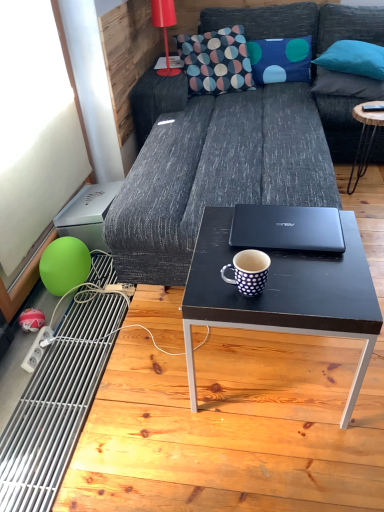
Locate an element on the screen. The width and height of the screenshot is (384, 512). black wood coffee table at right, which is the 1th coffee table in top-to-bottom order is located at coordinates (364, 140).

Measure the distance between point (200, 65) and camera.

Point (200, 65) and camera are 2.70 meters apart.

This screenshot has height=512, width=384. What do you see at coordinates (248, 271) in the screenshot? I see `white dotted ceramic mug at center` at bounding box center [248, 271].

Image resolution: width=384 pixels, height=512 pixels. In order to click on black wood coffee table at right, which is counted as the first coffee table, starting from the back in this screenshot , I will do `click(364, 140)`.

Is white dotted ceramic mug at center positioned in front of dark gray fabric couch at center?

A: Yes, it is.

Where is `studio couch that is on the right side of white dotted ceramic mug at center`? The width and height of the screenshot is (384, 512). studio couch that is on the right side of white dotted ceramic mug at center is located at coordinates (221, 166).

Does point (223, 271) come closer to viewer compared to point (326, 168)?

Yes, it is in front of point (326, 168).

Considering the sizes of objects white dotted ceramic mug at center and matte red lamp at upper left in the image provided, who is thinner, white dotted ceramic mug at center or matte red lamp at upper left?

white dotted ceramic mug at center.

Image resolution: width=384 pixels, height=512 pixels. Identify the location of coffee cup below the matte red lamp at upper left (from a real-world perspective). (248, 271).

Is white dotted ceramic mug at center at the left side of matte red lamp at upper left?

No.

Would you consider white dotted ceramic mug at center to be distant from matte red lamp at upper left?

That's right, there is a large distance between white dotted ceramic mug at center and matte red lamp at upper left.

How many degrees apart are the facing directions of dark gray fabric couch at center and matte green balloon at lower left?

The angle between the facing direction of dark gray fabric couch at center and the facing direction of matte green balloon at lower left is 89.1 degrees.

Is matte green balloon at lower left surrounded by dark gray fabric couch at center?

No, matte green balloon at lower left is not surrounded by dark gray fabric couch at center.

Locate an element on the screen. The image size is (384, 512). studio couch on the right side of matte green balloon at lower left is located at coordinates (221, 166).

What's the angular difference between teal fabric pillow at upper right, placed as the second pillow when sorted from left to right, and white dotted ceramic mug at center's facing directions?

The angular difference between teal fabric pillow at upper right, placed as the second pillow when sorted from left to right, and white dotted ceramic mug at center is 26.4 degrees.

How distant is teal fabric pillow at upper right, placed as the second pillow when sorted from left to right, from white dotted ceramic mug at center?

teal fabric pillow at upper right, placed as the second pillow when sorted from left to right, and white dotted ceramic mug at center are 6.16 feet apart from each other.

Considering the sizes of objects teal fabric pillow at upper right, placed as the second pillow when sorted from left to right, and white dotted ceramic mug at center in the image provided, who is wider, teal fabric pillow at upper right, placed as the second pillow when sorted from left to right, or white dotted ceramic mug at center?

Wider between the two is teal fabric pillow at upper right, placed as the second pillow when sorted from left to right.

From a real-world perspective, is teal fabric pillow at upper right, placed as the second pillow when sorted from left to right, on white dotted ceramic mug at center?

Yes, from a real-world perspective, teal fabric pillow at upper right, placed as the second pillow when sorted from left to right, is over white dotted ceramic mug at center

In the scene shown: Is black matte laptop at center directly adjacent to patterned fabric pillow at upper center?

No, black matte laptop at center is not with patterned fabric pillow at upper center.

Between black matte laptop at center and patterned fabric pillow at upper center, which one has less height?

With less height is black matte laptop at center.

Considering the relative sizes of black matte laptop at center and patterned fabric pillow at upper center in the image provided, is black matte laptop at center bigger than patterned fabric pillow at upper center?

No, black matte laptop at center is not bigger than patterned fabric pillow at upper center.

Which of these two, black matte laptop at center or patterned fabric pillow at upper center, is thinner?

With smaller width is black matte laptop at center.

Which of these two, black matte laptop at center or white dotted ceramic mug at center, stands taller?

white dotted ceramic mug at center is taller.

From a real-world perspective, relative to white dotted ceramic mug at center, is black matte laptop at center vertically above or below?

In terms of real-world spatial position, black matte laptop at center is below white dotted ceramic mug at center.

Considering their positions, is teal fabric pillow at upper right, which appears as the first pillow when viewed from the right, located in front of or behind black matte coffee table at center, which appears as the 1th coffee table when viewed from the front?

In the image, teal fabric pillow at upper right, which appears as the first pillow when viewed from the right, appears behind black matte coffee table at center, which appears as the 1th coffee table when viewed from the front.

From a real-world perspective, is teal fabric pillow at upper right, which appears as the first pillow when viewed from the right, above or below black matte coffee table at center, which is counted as the 1th coffee table, starting from the left?

teal fabric pillow at upper right, which appears as the first pillow when viewed from the right, is situated higher than black matte coffee table at center, which is counted as the 1th coffee table, starting from the left, in the real world.

Is point (378, 81) positioned before point (356, 284)?

No, it is behind (356, 284).

Locate an element on the screen. coffee cup that is on the left side of dark gray fabric couch at center is located at coordinates (248, 271).

Identify the location of coffee cup below the matte red lamp at upper left (from a real-world perspective). This screenshot has width=384, height=512. (248, 271).

Based on their spatial positions, is dark gray fabric couch at center or matte red lamp at upper left closer to black wood coffee table at right, which appears as the first coffee table when viewed from the right?

dark gray fabric couch at center lies closer to black wood coffee table at right, which appears as the first coffee table when viewed from the right, than the other object.

When comparing their distances from black matte coffee table at center, the 2th coffee table viewed from the right, does patterned fabric pillow at upper center or matte green balloon at lower left seem further?

Among the two, patterned fabric pillow at upper center is located further to black matte coffee table at center, the 2th coffee table viewed from the right.

Based on their spatial positions, is black matte laptop at center or teal fabric pillow at upper right, the 2th pillow from the right, further from matte red lamp at upper left?

black matte laptop at center is further to matte red lamp at upper left.

When comparing their distances from teal fabric pillow at upper right, the third pillow from the left, does teal fabric pillow at upper right, the 2th pillow from the right, or white dotted ceramic mug at center seem closer?

teal fabric pillow at upper right, the 2th pillow from the right, is positioned closer to the anchor teal fabric pillow at upper right, the third pillow from the left.

Considering their positions, is teal fabric pillow at upper right, which appears as the first pillow when viewed from the right, positioned further to matte green balloon at lower left than white dotted ceramic mug at center?

Based on the image, teal fabric pillow at upper right, which appears as the first pillow when viewed from the right, appears to be further to matte green balloon at lower left.

Estimate the real-world distances between objects in this image. Which object is further from dark gray fabric couch at center, black matte laptop at center or teal fabric pillow at upper right, the third pillow from the left?

Based on the image, teal fabric pillow at upper right, the third pillow from the left, appears to be further to dark gray fabric couch at center.

When comparing their distances from white dotted ceramic mug at center, does black matte laptop at center or matte green balloon at lower left seem closer?

Among the two, black matte laptop at center is located nearer to white dotted ceramic mug at center.

Consider the image. Based on their spatial positions, is white dotted ceramic mug at center or teal fabric pillow at upper right, the third pillow from the left, further from dark gray fabric couch at center?

white dotted ceramic mug at center is further to dark gray fabric couch at center.

The height and width of the screenshot is (512, 384). I want to click on throw pillow between matte red lamp at upper left and black wood coffee table at right, which appears as the first coffee table when viewed from the right, in the horizontal direction, so click(216, 61).

This screenshot has width=384, height=512. Identify the location of laptop that lies between blue dotted fabric pillow at upper center, the first pillow when ordered from left to right, and matte green balloon at lower left from top to bottom. (287, 228).

The image size is (384, 512). What are the coordinates of `studio couch situated between matte green balloon at lower left and black matte laptop at center from left to right` in the screenshot? It's located at (221, 166).

The height and width of the screenshot is (512, 384). I want to click on studio couch between black matte coffee table at center, the first coffee table from the bottom, and black wood coffee table at right, positioned as the 2th coffee table in left-to-right order, along the z-axis, so click(221, 166).